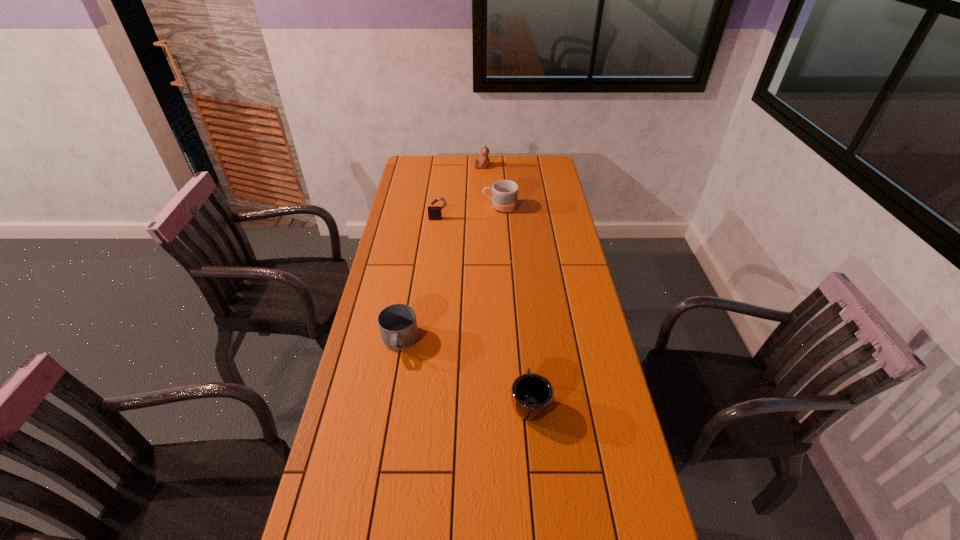
This screenshot has width=960, height=540. Identify the location of teddy bear. (483, 162).

I want to click on the fourth nearest object, so (x=505, y=192).

At what (x,y) coordinates should I click in order to perform the action: click on the third nearest object. Please return your answer as a coordinate pair (x, y). Looking at the image, I should click on (434, 212).

At what (x,y) coordinates should I click in order to perform the action: click on the second nearest mug. Please return your answer as a coordinate pair (x, y). The image size is (960, 540). Looking at the image, I should click on (398, 326).

The image size is (960, 540). I want to click on the leftmost mug, so click(x=398, y=326).

Locate an element on the screen. Image resolution: width=960 pixels, height=540 pixels. the nearest mug is located at coordinates (532, 394).

Find the location of a particular element. Image resolution: width=960 pixels, height=540 pixels. free location located 0.250m on the face of the teddy bear is located at coordinates (425, 166).

This screenshot has height=540, width=960. What are the coordinates of `vacant position located on the face of the teddy bear` in the screenshot? It's located at (454, 166).

Where is `vacant space situated 0.260m on the face of the teddy bear`? This screenshot has height=540, width=960. vacant space situated 0.260m on the face of the teddy bear is located at coordinates (423, 166).

Identify the location of vacant space situated 0.100m on the side with the handle of the second farthest object. The height and width of the screenshot is (540, 960). (460, 207).